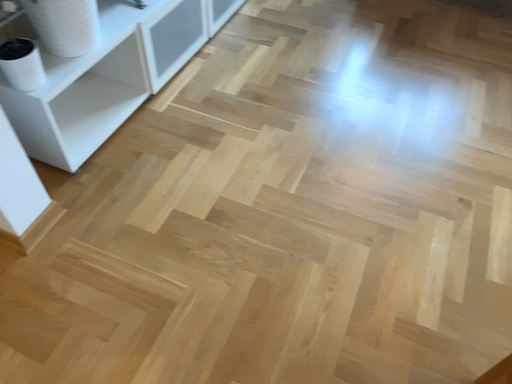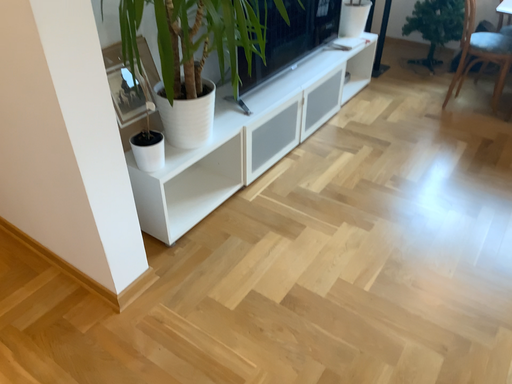
Question: Which way did the camera rotate in the video?

Choices:
 (A) rotated upward
 (B) rotated downward

Answer: (A)